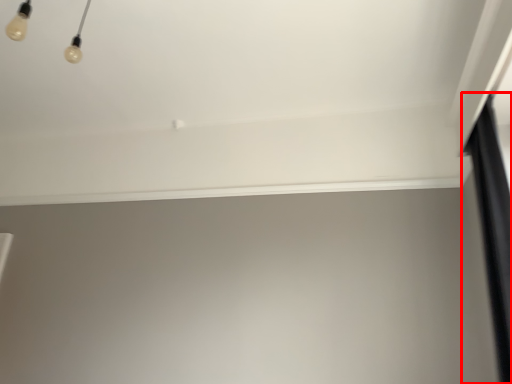
Question: Considering the relative positions of curtain (annotated by the red box) and window sill in the image provided, where is curtain (annotated by the red box) located with respect to the staircase?

Choices:
 (A) right
 (B) left

Answer: (A)